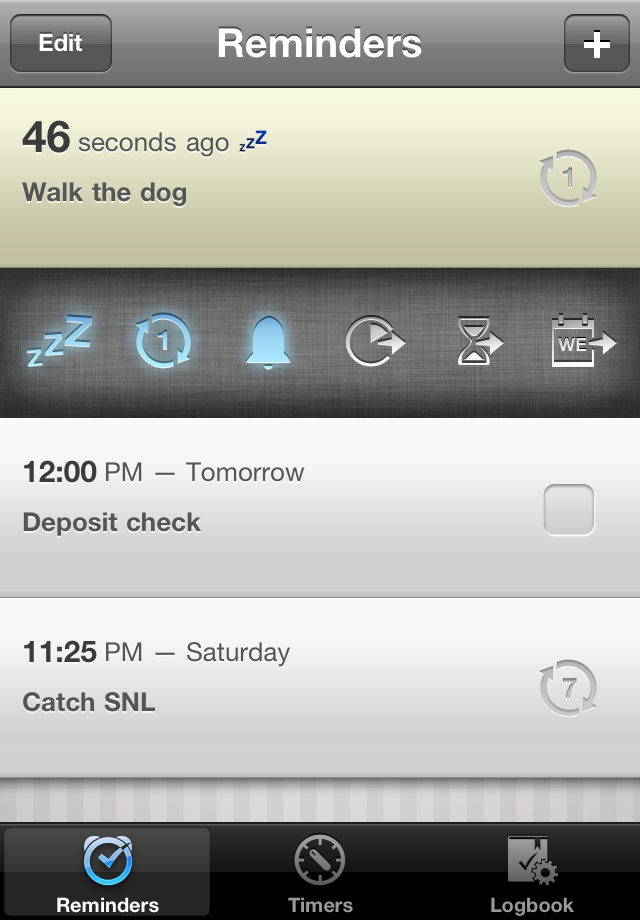
You are a GUI agent. You are given a task and a screenshot of the screen. Output one action in this format:
    pyautogui.click(x=<x>, y=<y>)
    Task: Click on the entry items
    
    Given the screenshot: What is the action you would take?
    pyautogui.click(x=239, y=174), pyautogui.click(x=196, y=702), pyautogui.click(x=252, y=514)